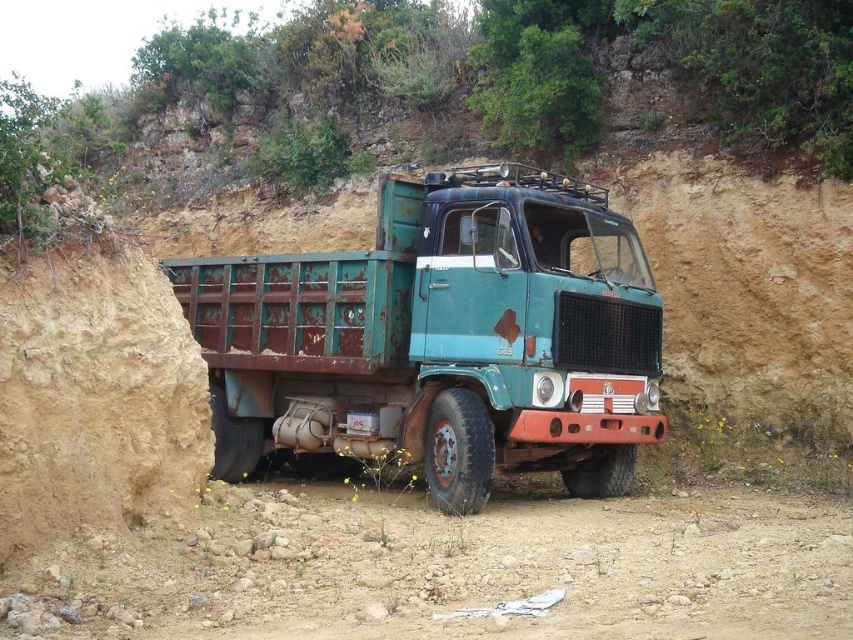
This screenshot has width=853, height=640. What do you see at coordinates (440, 339) in the screenshot? I see `rusty metal trailer truck at center` at bounding box center [440, 339].

Does rusty metal trailer truck at center have a lesser width compared to brown dusty ground at lower center?

No.

Find the location of a particular element. The image size is (853, 640). rusty metal trailer truck at center is located at coordinates (440, 339).